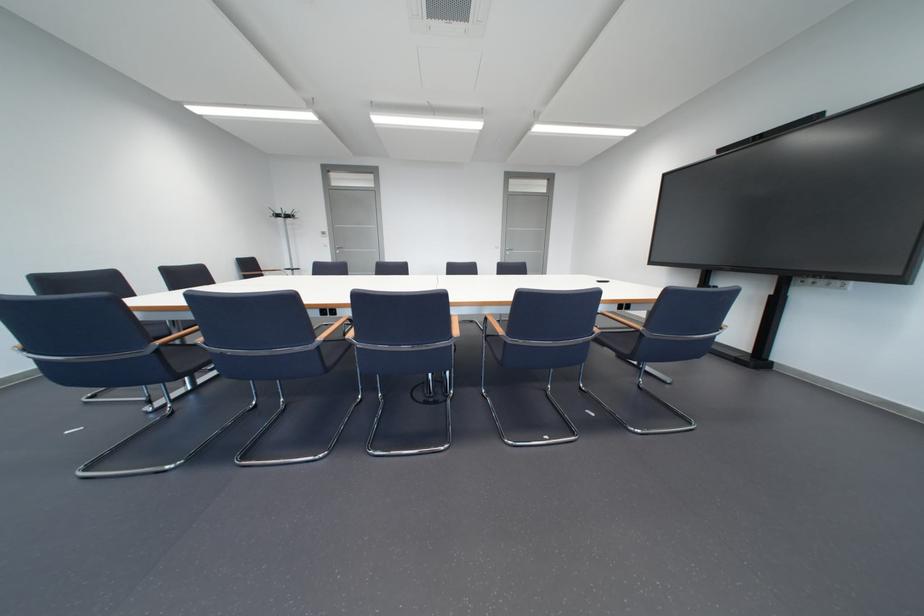
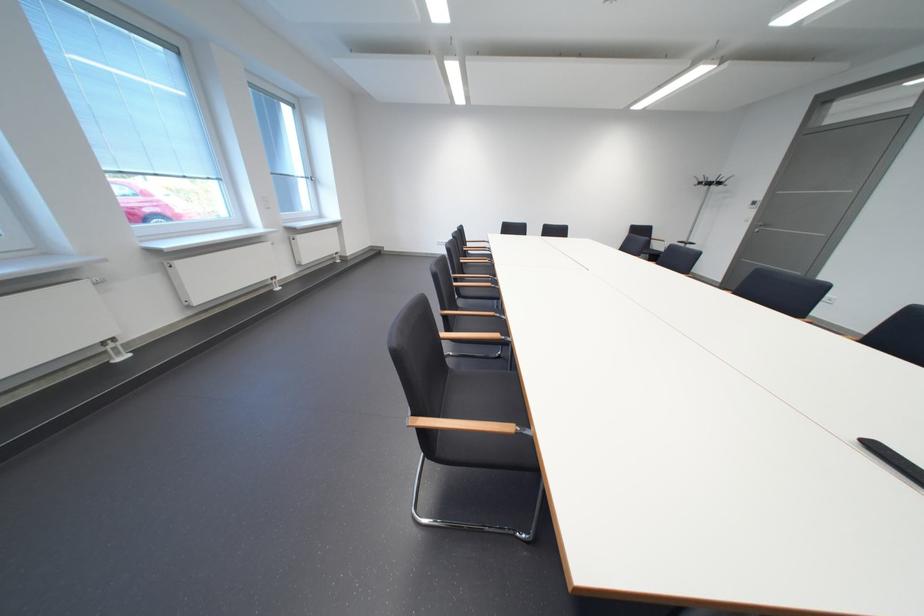
Where in the second image is the point corresponding to the point at 301,217 from the first image?

(723, 185)